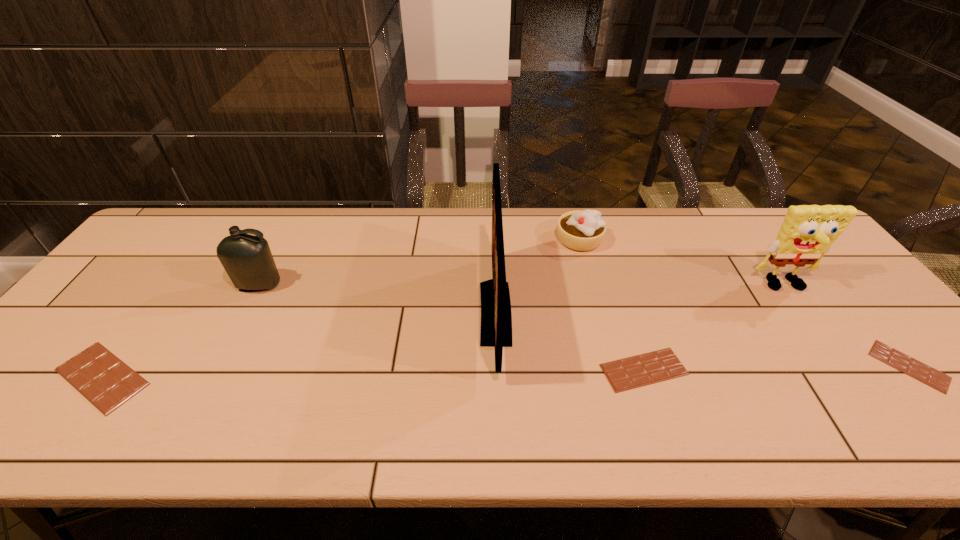
At what (x,y) coordinates should I click in order to perform the action: click on vacant space that satisfies the following two spatial constraints: 1. on the face of the second tallest object; 2. on the front-facing side of the monitor. Please return your answer as a coordinate pair (x, y). Image resolution: width=960 pixels, height=540 pixels. Looking at the image, I should click on (804, 313).

The image size is (960, 540). I want to click on free space that satisfies the following two spatial constraints: 1. on the front-facing side of the second chocolate bar from right to left; 2. on the right side of the monitor, so click(497, 370).

This screenshot has height=540, width=960. I want to click on free space that satisfies the following two spatial constraints: 1. on the back side of the leftmost chocolate bar; 2. on the left side of the second shortest chocolate bar, so click(108, 370).